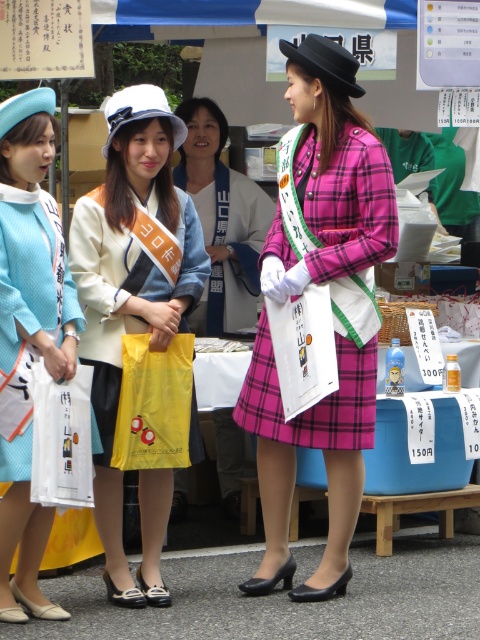
Is light blue textured fabric dress at left positioned behind pink plaid dress at center?

No, light blue textured fabric dress at left is in front of pink plaid dress at center.

Which is behind, point (37, 252) or point (244, 404)?

The point (244, 404) is behind.

Is point (19, 598) closer to camera compared to point (315, 204)?

Yes, it is.

Where is `light blue textured fabric dress at left`? This screenshot has width=480, height=640. light blue textured fabric dress at left is located at coordinates (28, 336).

Can you confirm if matte yellow plastic bag at center is smaller than pink plaid dress at center?

Actually, matte yellow plastic bag at center might be larger than pink plaid dress at center.

Between point (164, 220) and point (346, 173), which one is positioned in front?

Point (346, 173) is in front.

Between point (170, 317) and point (340, 406), which one is positioned behind?

Positioned behind is point (340, 406).

Image resolution: width=480 pixels, height=640 pixels. I want to click on matte yellow plastic bag at center, so click(x=133, y=305).

Who is positioned more to the right, light blue textured fabric dress at left or pink plaid skirt at center?

From the viewer's perspective, pink plaid skirt at center appears more on the right side.

Who is more distant from viewer, (3,513) or (243,216)?

Positioned behind is point (243,216).

This screenshot has width=480, height=640. In order to click on light blue textured fabric dress at left in this screenshot , I will do `click(28, 336)`.